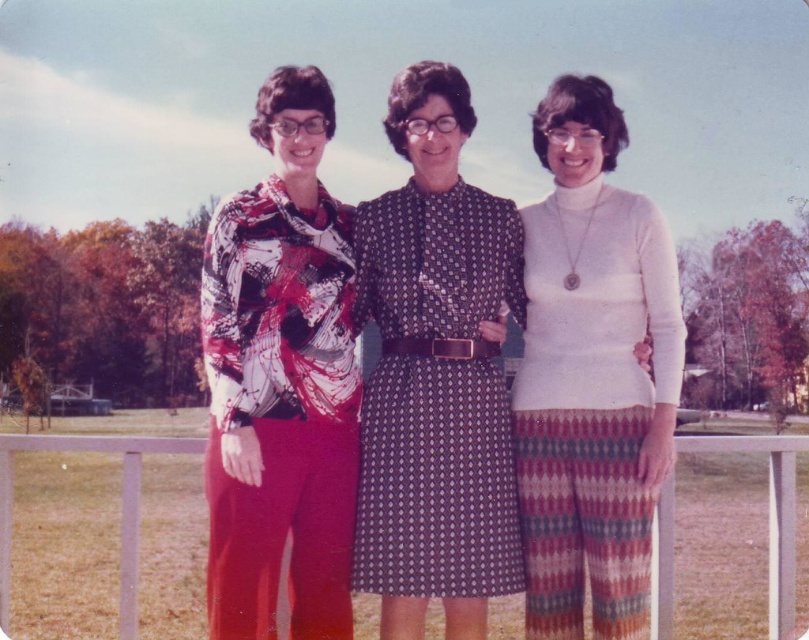
Question: Is printed silk blouse at left to the right of white knitwear at center from the viewer's perspective?

Choices:
 (A) yes
 (B) no

Answer: (B)

Question: Which point appears closest to the camera in this image?

Choices:
 (A) (223, 497)
 (B) (676, 372)
 (C) (394, 266)

Answer: (A)

Question: Which object is closer to the camera taking this photo?

Choices:
 (A) printed silk blouse at left
 (B) printed fabric dress at center
 (C) white knitwear at center

Answer: (C)

Question: Which point appears farthest from the camera in this image?

Choices:
 (A) (411, 392)
 (B) (553, 401)

Answer: (A)

Question: Does printed silk blouse at left have a smaller size compared to white knitwear at center?

Choices:
 (A) yes
 (B) no

Answer: (A)

Question: Can you confirm if printed silk blouse at left is smaller than printed fabric dress at center?

Choices:
 (A) yes
 (B) no

Answer: (A)